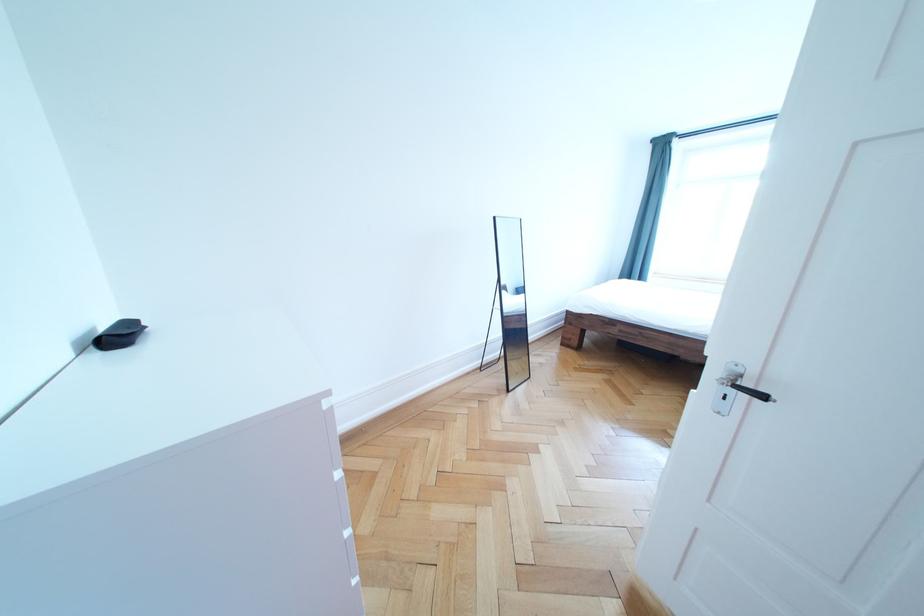
Where is `small black case`? small black case is located at coordinates (118, 334).